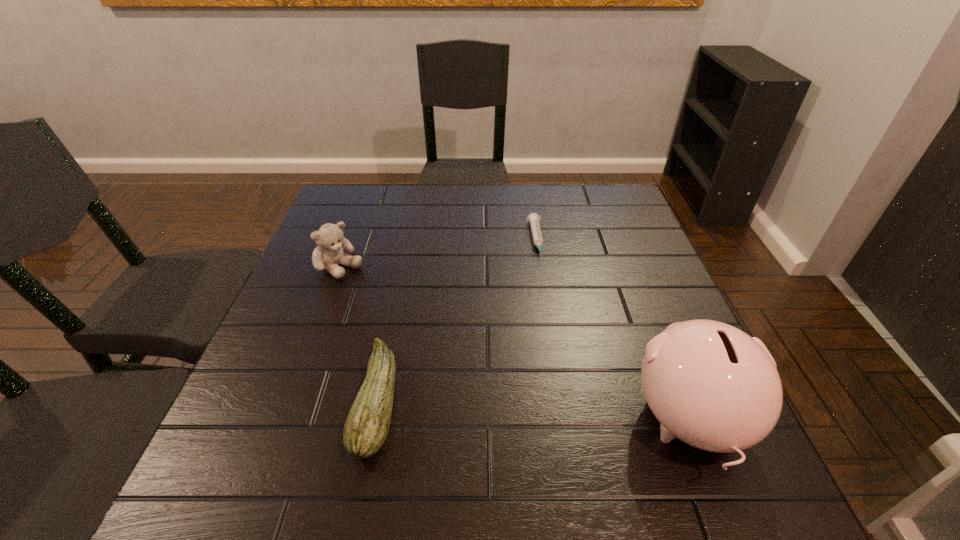
What are the coordinates of `vacant space located 0.180m at the stem end of the second shortest object` in the screenshot? It's located at [x=263, y=399].

Locate an element on the screen. Image resolution: width=960 pixels, height=540 pixels. free space located on the left of the tallest object is located at coordinates (500, 422).

Locate an element on the screen. The height and width of the screenshot is (540, 960). vacant space located on the face of the second tallest object is located at coordinates (455, 352).

At what (x,y) coordinates should I click in order to perform the action: click on vacant area situated 0.090m on the face of the second tallest object. Please return your answer as a coordinate pair (x, y). Looking at the image, I should click on (376, 295).

Locate an element on the screen. This screenshot has height=540, width=960. blank area located 0.390m on the face of the second tallest object is located at coordinates (468, 362).

Identify the location of free space located 0.150m at the needle end of the shortest object. This screenshot has height=540, width=960. (548, 305).

Locate an element on the screen. The height and width of the screenshot is (540, 960). vacant position located 0.110m at the needle end of the shortest object is located at coordinates click(x=545, y=293).

This screenshot has height=540, width=960. What are the coordinates of `free space located 0.060m at the needle end of the shortest object` in the screenshot? It's located at (543, 279).

Image resolution: width=960 pixels, height=540 pixels. I want to click on object that is at the far edge, so click(533, 218).

The image size is (960, 540). I want to click on zucchini that is at the near edge, so click(366, 428).